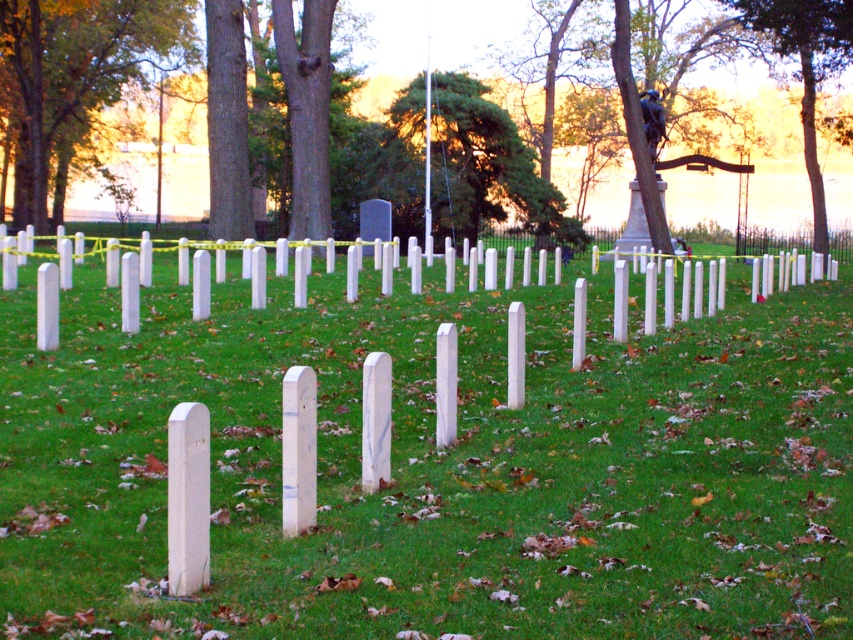
Question: Which point is closer to the camera?

Choices:
 (A) white smooth grass at center
 (B) green leafy tree at center
 (C) green leafy tree at upper left

Answer: (A)

Question: Where is white smooth grass at center located in relation to green leafy tree at center in the image?

Choices:
 (A) below
 (B) above

Answer: (A)

Question: Can you confirm if white smooth grass at center is wider than green leafy tree at upper left?

Choices:
 (A) no
 (B) yes

Answer: (B)

Question: Based on their relative distances, which object is farther from the green leafy tree at center?

Choices:
 (A) green leafy tree at upper left
 (B) white smooth grass at center

Answer: (B)

Question: From the image, what is the correct spatial relationship of green leafy tree at upper left in relation to green leafy tree at upper center?

Choices:
 (A) right
 (B) left

Answer: (B)

Question: Which object is closer to the camera taking this photo?

Choices:
 (A) white smooth grass at center
 (B) green leafy tree at upper center

Answer: (A)